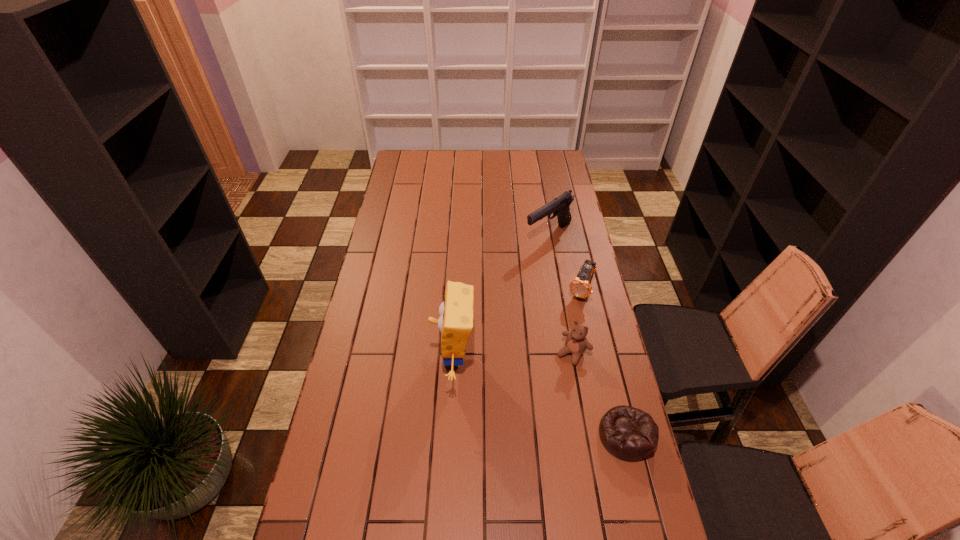
This screenshot has height=540, width=960. Find the location of `free space on the desktop that is between the sponge and the nearest object and is positioned at the muzzle of the gun`. free space on the desktop that is between the sponge and the nearest object and is positioned at the muzzle of the gun is located at coordinates (529, 392).

The height and width of the screenshot is (540, 960). Identify the location of vacant space on the desktop that is between the leftmost object and the beanbag and is positioned on the face of the fourth nearest object. (530, 393).

Locate an element on the screen. free space on the desktop that is between the sponge and the shortest object and is positioned on the front-facing side of the teddy bear is located at coordinates (540, 397).